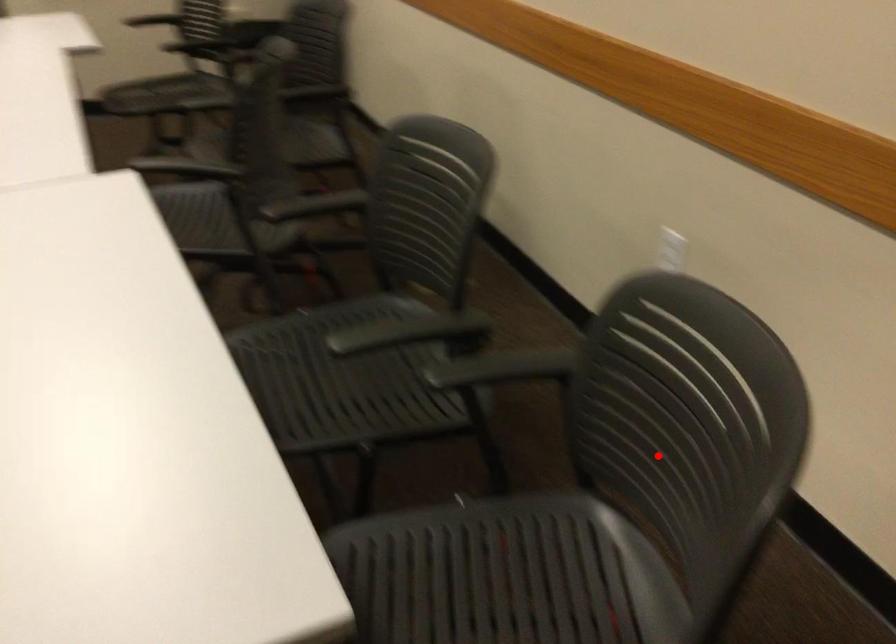
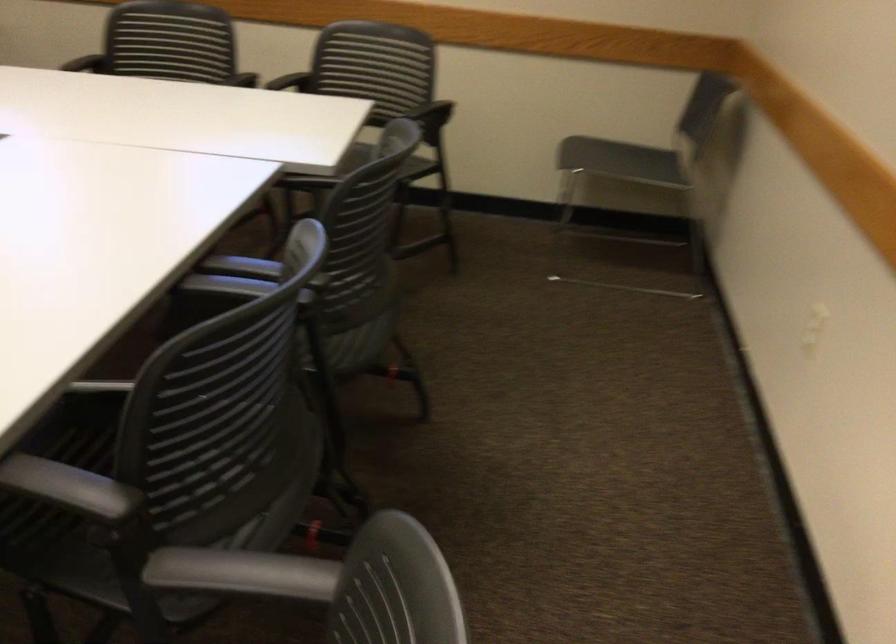
Where in the second image is the point corresponding to the highlighted location from the first image?

(375, 73)